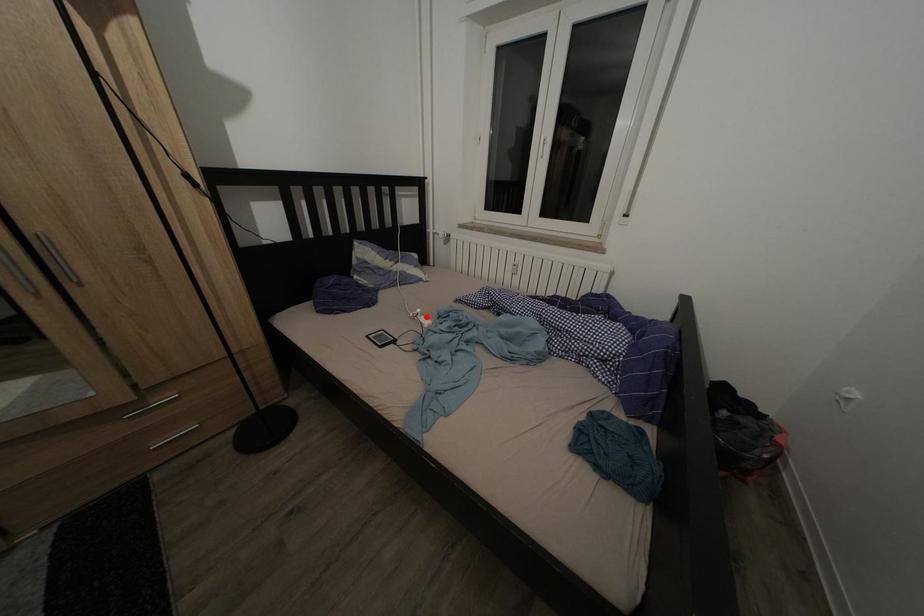
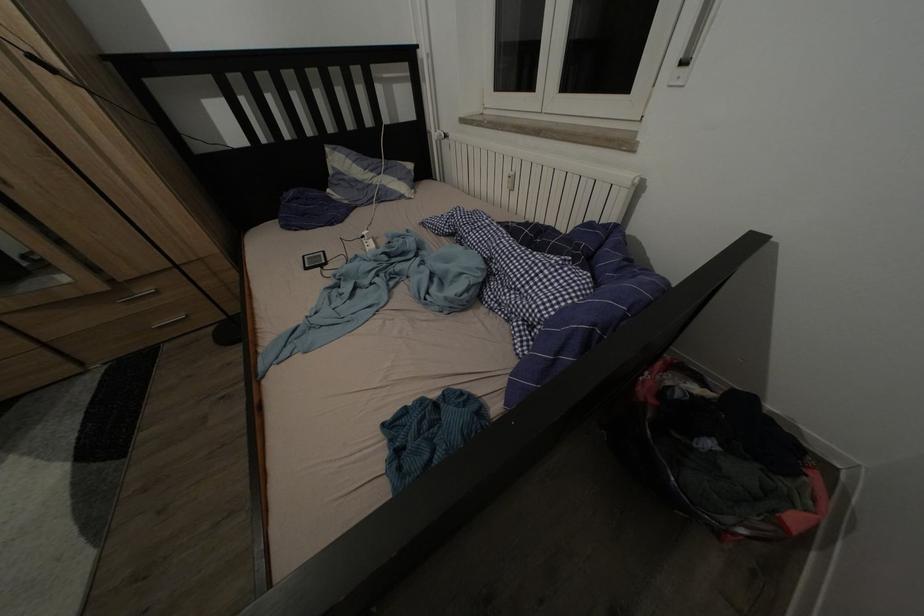
Where in the second image is the point corresponding to the highlighted location from the first image?

(372, 238)